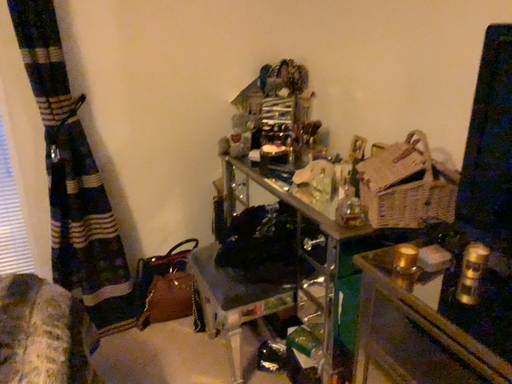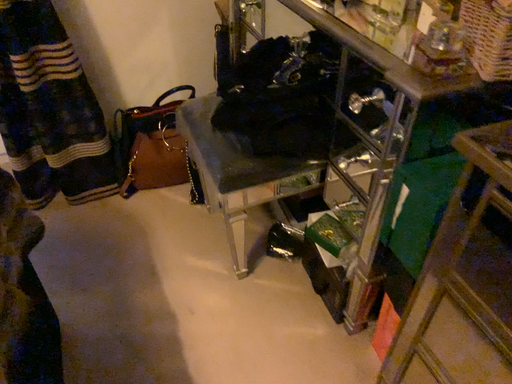
Question: How did the camera likely rotate when shooting the video?

Choices:
 (A) rotated downward
 (B) rotated upward

Answer: (A)